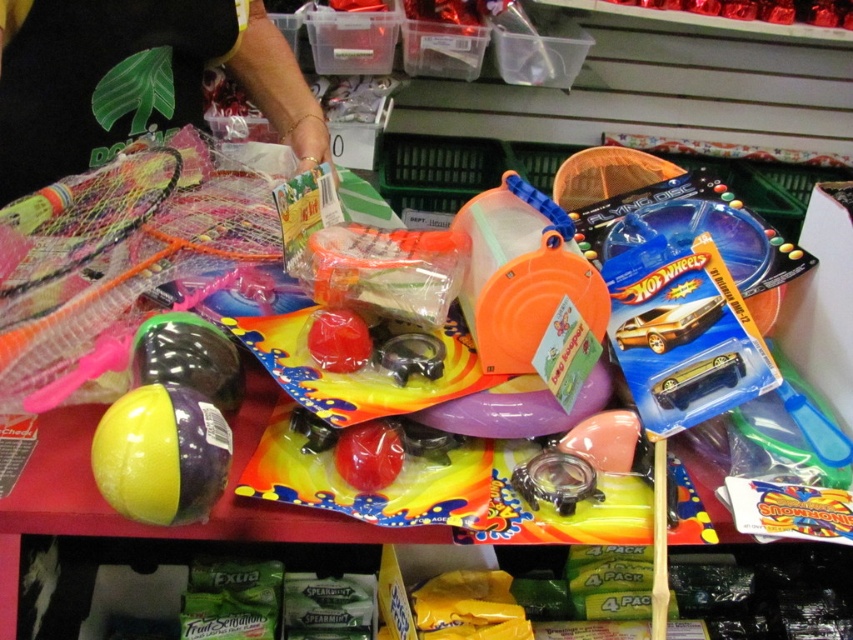
How distant is yellow rubber ball at lower left from multicolored mesh tennis racket at left?

The distance of yellow rubber ball at lower left from multicolored mesh tennis racket at left is 11.24 inches.

Is yellow rubber ball at lower left positioned before multicolored mesh tennis racket at left?

Yes, it is in front of multicolored mesh tennis racket at left.

Which is in front, point (177, 387) or point (55, 204)?

Point (177, 387) is more forward.

At what (x,y) coordinates should I click in order to perform the action: click on yellow rubber ball at lower left. Please return your answer as a coordinate pair (x, y). Looking at the image, I should click on (161, 454).

Is black mesh netting at left positioned in front of multicolored mesh tennis racket at left?

No, it is not.

Who is positioned more to the left, black mesh netting at left or multicolored mesh tennis racket at left?

From the viewer's perspective, multicolored mesh tennis racket at left appears more on the left side.

Is point (65, 48) farther from camera compared to point (15, 205)?

Yes, point (65, 48) is behind point (15, 205).

Locate an element on the screen. This screenshot has width=853, height=640. black mesh netting at left is located at coordinates (123, 58).

Does black mesh netting at left have a smaller size compared to yellow rubber ball at lower left?

Incorrect, black mesh netting at left is not smaller in size than yellow rubber ball at lower left.

Does point (86, 52) come farther from viewer compared to point (138, 520)?

Yes, it is.

Where is `black mesh netting at left`? The height and width of the screenshot is (640, 853). black mesh netting at left is located at coordinates (123, 58).